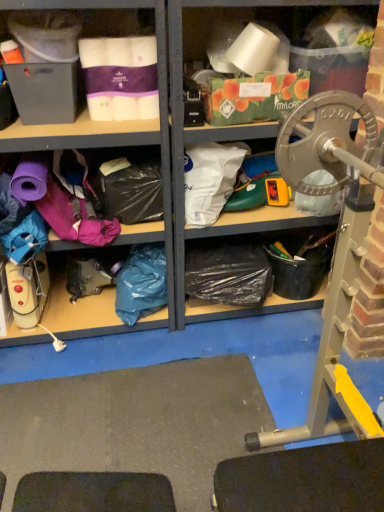
Question: Is the depth of blue plastic bag at lower left, which appears as the second clothing when viewed from the top, less than that of white plastic bag at center, the first clothing viewed from the top?

Choices:
 (A) yes
 (B) no

Answer: (B)

Question: Is blue plastic bag at lower left, the 2th clothing viewed from the right, to the left of white plastic bag at center, positioned as the 1th clothing in right-to-left order, from the viewer's perspective?

Choices:
 (A) no
 (B) yes

Answer: (B)

Question: Is blue plastic bag at lower left, the 2th clothing viewed from the right, outside of white plastic bag at center, arranged as the 2th clothing when viewed from the left?

Choices:
 (A) no
 (B) yes

Answer: (B)

Question: Does blue plastic bag at lower left, the 2th clothing viewed from the right, have a smaller size compared to white plastic bag at center, arranged as the 2th clothing when viewed from the left?

Choices:
 (A) no
 (B) yes

Answer: (A)

Question: Is blue plastic bag at lower left, positioned as the 1th clothing in bottom-to-top order, shorter than white plastic bag at center, which is the 2th clothing in bottom-to-top order?

Choices:
 (A) yes
 (B) no

Answer: (B)

Question: Does blue plastic bag at lower left, positioned as the 1th clothing in bottom-to-top order, have a lesser width compared to white plastic bag at center, arranged as the 2th clothing when viewed from the left?

Choices:
 (A) yes
 (B) no

Answer: (A)

Question: Considering the relative positions of white plastic bag at center, arranged as the 2th clothing when viewed from the left, and blue plastic bag at lower left, which appears as the second clothing when viewed from the top, in the image provided, is white plastic bag at center, arranged as the 2th clothing when viewed from the left, to the left of blue plastic bag at lower left, which appears as the second clothing when viewed from the top, from the viewer's perspective?

Choices:
 (A) yes
 (B) no

Answer: (B)

Question: Considering the relative sizes of white plastic bag at center, which is the 2th clothing in bottom-to-top order, and blue plastic bag at lower left, the 2th clothing viewed from the right, in the image provided, is white plastic bag at center, which is the 2th clothing in bottom-to-top order, taller than blue plastic bag at lower left, the 2th clothing viewed from the right,?

Choices:
 (A) no
 (B) yes

Answer: (A)

Question: From a real-world perspective, is white plastic bag at center, which is the 2th clothing in bottom-to-top order, located beneath blue plastic bag at lower left, placed as the 1th clothing when sorted from left to right?

Choices:
 (A) no
 (B) yes

Answer: (A)

Question: From the image's perspective, is white plastic bag at center, positioned as the 1th clothing in right-to-left order, below blue plastic bag at lower left, placed as the 1th clothing when sorted from left to right?

Choices:
 (A) no
 (B) yes

Answer: (A)

Question: Can you confirm if white plastic bag at center, the first clothing viewed from the top, is bigger than blue plastic bag at lower left, which appears as the second clothing when viewed from the top?

Choices:
 (A) no
 (B) yes

Answer: (A)

Question: Is white plastic bag at center, positioned as the 1th clothing in right-to-left order, aimed at blue plastic bag at lower left, placed as the 1th clothing when sorted from left to right?

Choices:
 (A) no
 (B) yes

Answer: (A)

Question: Considering their positions, is white plastic bag at center, which is the 2th clothing in bottom-to-top order, located in front of or behind blue plastic bag at lower left, placed as the 1th clothing when sorted from left to right?

Choices:
 (A) behind
 (B) front

Answer: (B)